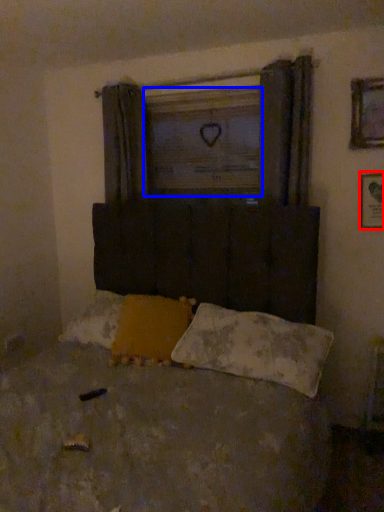
Question: Which of the following is the closest to the observer, picture frame (highlighted by a red box) or window screen (highlighted by a blue box)?

Choices:
 (A) picture frame
 (B) window screen

Answer: (A)